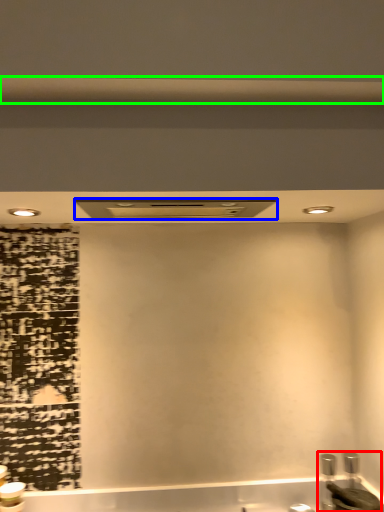
Question: Based on their relative distances, which object is farther from sink (highlighted by a red box)? Choose from exhaust hood (highlighted by a blue box) and beam (highlighted by a green box).

Choices:
 (A) exhaust hood
 (B) beam

Answer: (B)